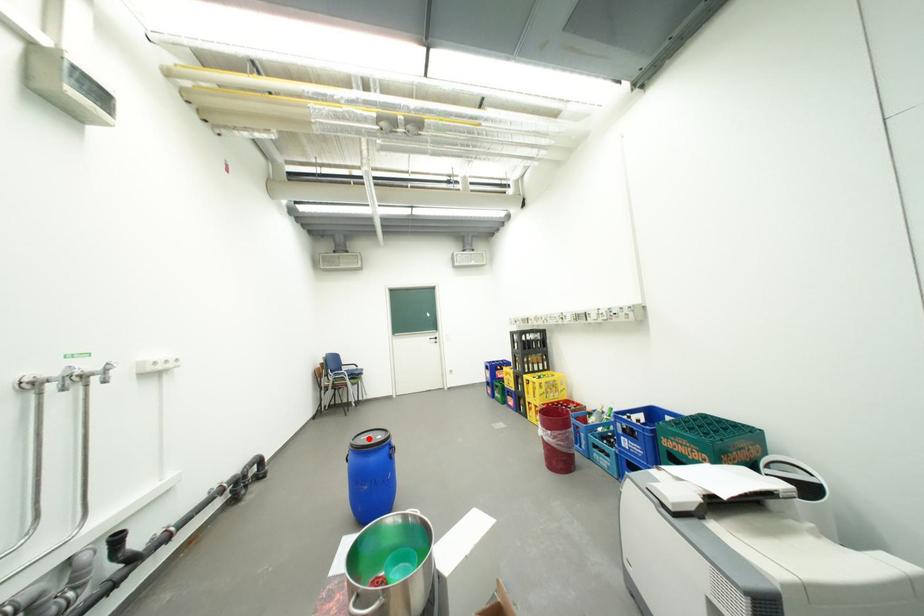
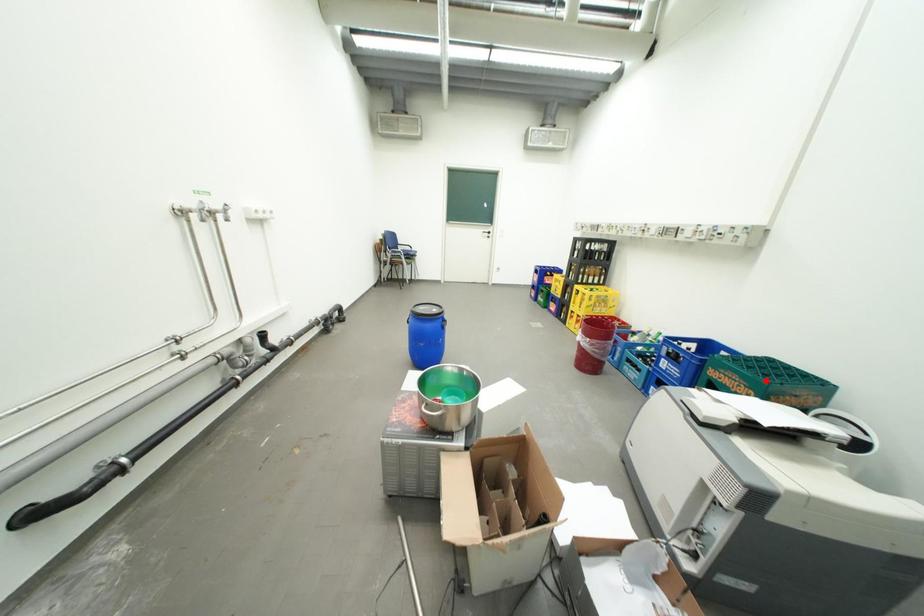
I am providing you with two images of the same scene from different viewpoints. A red point is marked on the first image and another point is marked on the second image. Is the marked point in image1 the same physical position as the marked point in image2?

No